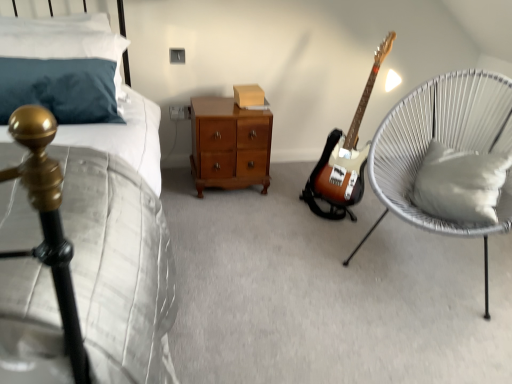
This screenshot has height=384, width=512. Describe the element at coordinates (60, 67) in the screenshot. I see `teal fabric pillow at upper left, placed as the first pillow when sorted from left to right` at that location.

Locate an element on the screen. This screenshot has width=512, height=384. teal fabric pillow at upper left, which is the 1th pillow in top-to-bottom order is located at coordinates (60, 67).

This screenshot has width=512, height=384. Describe the element at coordinates (229, 145) in the screenshot. I see `wooden nightstand at center` at that location.

Identify the location of matte gold headboard at left. tap(103, 220).

Describe the element at coordinates (460, 184) in the screenshot. The width and height of the screenshot is (512, 384). I see `white soft cushion at right, which is the 2th pillow in left-to-right order` at that location.

Locate an element on the screen. teal fabric pillow at upper left, which appears as the second pillow when ordered from the bottom is located at coordinates point(60,67).

Looking at their sizes, would you say white woven chair at right is wider or thinner than matte gold headboard at left?

Clearly, white woven chair at right has less width compared to matte gold headboard at left.

From the image's perspective, which is below, white woven chair at right or matte gold headboard at left?

matte gold headboard at left, from the image's perspective.

In the image, is white woven chair at right positioned in front of or behind matte gold headboard at left?

Clearly, white woven chair at right is behind matte gold headboard at left.

Between white soft cushion at right, which is the 2th pillow in left-to-right order, and matte cardboard box at center, which one has larger width?

white soft cushion at right, which is the 2th pillow in left-to-right order.

Who is more distant, white soft cushion at right, which is the 1th pillow from bottom to top, or matte cardboard box at center?

matte cardboard box at center is further away from the camera.

Which of these two, white soft cushion at right, which is the 1th pillow from bottom to top, or matte cardboard box at center, is smaller?

matte cardboard box at center is smaller.

Is white soft cushion at right, placed as the 2th pillow when sorted from top to bottom, at the right side of matte cardboard box at center?

Yes.

Is matte cardboard box at center situated inside matte gold headboard at left or outside?

matte cardboard box at center is outside matte gold headboard at left.

Which of these two, matte cardboard box at center or matte gold headboard at left, is smaller?

matte cardboard box at center is smaller.

From a real-world perspective, does matte cardboard box at center sit lower than matte gold headboard at left?

Incorrect, from a real-world perspective, matte cardboard box at center is higher than matte gold headboard at left.

Can you confirm if wooden nightstand at center is shorter than matte gold headboard at left?

Yes, wooden nightstand at center is shorter than matte gold headboard at left.

From the image's perspective, between wooden nightstand at center and matte gold headboard at left, which one is located above?

From the image's view, wooden nightstand at center is above.

Based on the photo, considering the relative sizes of wooden nightstand at center and matte gold headboard at left in the image provided, is wooden nightstand at center wider than matte gold headboard at left?

In fact, wooden nightstand at center might be narrower than matte gold headboard at left.

Based on the photo, from a real-world perspective, is wooden nightstand at center beneath matte gold headboard at left?

Yes, from a real-world perspective, wooden nightstand at center is beneath matte gold headboard at left.

Considering the relative positions of teal fabric pillow at upper left, which is the 1th pillow in top-to-bottom order, and wooden nightstand at center in the image provided, is teal fabric pillow at upper left, which is the 1th pillow in top-to-bottom order, in front of wooden nightstand at center?

That is True.

Consider the image. Is teal fabric pillow at upper left, which appears as the second pillow when ordered from the bottom, inside the boundaries of wooden nightstand at center, or outside?

teal fabric pillow at upper left, which appears as the second pillow when ordered from the bottom, exists outside the volume of wooden nightstand at center.

Considering the sizes of teal fabric pillow at upper left, which is the 1th pillow in top-to-bottom order, and wooden nightstand at center in the image, is teal fabric pillow at upper left, which is the 1th pillow in top-to-bottom order, wider or thinner than wooden nightstand at center?

Considering their sizes, teal fabric pillow at upper left, which is the 1th pillow in top-to-bottom order, looks slimmer than wooden nightstand at center.

Is teal fabric pillow at upper left, which is the 1th pillow in top-to-bottom order, turned away from wooden nightstand at center?

No, teal fabric pillow at upper left, which is the 1th pillow in top-to-bottom order, is not facing away from wooden nightstand at center.

Considering the sizes of objects white soft cushion at right, which is the 2th pillow in left-to-right order, and matte gold headboard at left in the image provided, who is wider, white soft cushion at right, which is the 2th pillow in left-to-right order, or matte gold headboard at left?

matte gold headboard at left.

From a real-world perspective, count 1st pillows upward from the matte gold headboard at left and point to it. Please provide its 2D coordinates.

[(460, 184)]

From the image's perspective, is white soft cushion at right, which is the 1th pillow from bottom to top, located beneath matte gold headboard at left?

No, from the image's perspective, white soft cushion at right, which is the 1th pillow from bottom to top, is not below matte gold headboard at left.

Starting from the white woven chair at right, which pillow is the 2nd one behind? Please provide its 2D coordinates.

[(60, 67)]

Is white woven chair at right spatially inside teal fabric pillow at upper left, which is the 1th pillow in top-to-bottom order, or outside of it?

white woven chair at right lies outside teal fabric pillow at upper left, which is the 1th pillow in top-to-bottom order.

Is white woven chair at right positioned before teal fabric pillow at upper left, placed as the first pillow when sorted from left to right?

Yes, white woven chair at right is closer to the viewer.

Between point (429, 81) and point (80, 99), which one is positioned behind?

Positioned behind is point (429, 81).

Where is `bed that appears below the white woven chair at right (from a real-world perspective)`? The height and width of the screenshot is (384, 512). bed that appears below the white woven chair at right (from a real-world perspective) is located at coordinates coord(103,220).

Identify the location of box that appears above the white soft cushion at right, the first pillow viewed from the right (from a real-world perspective). This screenshot has height=384, width=512. (248, 95).

When comparing their distances from white soft cushion at right, placed as the 2th pillow when sorted from top to bottom, does matte gold headboard at left or white woven chair at right seem closer?

Among the two, white woven chair at right is located nearer to white soft cushion at right, placed as the 2th pillow when sorted from top to bottom.

Looking at the image, which one is located further to matte cardboard box at center, wooden nightstand at center or matte gold headboard at left?

matte gold headboard at left lies further to matte cardboard box at center than the other object.

Estimate the real-world distances between objects in this image. Which object is closer to white soft cushion at right, which is the 1th pillow from bottom to top, teal fabric pillow at upper left, which is the 1th pillow in top-to-bottom order, or matte gold headboard at left?

matte gold headboard at left is positioned closer to the anchor white soft cushion at right, which is the 1th pillow from bottom to top.

Based on their spatial positions, is matte cardboard box at center or wooden nightstand at center closer to sunburst wood electric guitar at center?

wooden nightstand at center.

Looking at the image, which one is located further to white soft cushion at right, which is the 2th pillow in left-to-right order, sunburst wood electric guitar at center or teal fabric pillow at upper left, which appears as the second pillow when ordered from the bottom?

teal fabric pillow at upper left, which appears as the second pillow when ordered from the bottom, is positioned further to the anchor white soft cushion at right, which is the 2th pillow in left-to-right order.

Considering their positions, is wooden nightstand at center positioned closer to white soft cushion at right, the first pillow viewed from the right, than white woven chair at right?

white woven chair at right is positioned closer to the anchor white soft cushion at right, the first pillow viewed from the right.

From the image, which object appears to be farther from matte cardboard box at center, teal fabric pillow at upper left, placed as the first pillow when sorted from left to right, or white soft cushion at right, which is the 2th pillow in left-to-right order?

white soft cushion at right, which is the 2th pillow in left-to-right order.

Which object lies nearer to the anchor point matte cardboard box at center, wooden nightstand at center or sunburst wood electric guitar at center?

Among the two, wooden nightstand at center is located nearer to matte cardboard box at center.

Identify the location of chair situated between matte gold headboard at left and white soft cushion at right, which is the 1th pillow from bottom to top, from left to right. This screenshot has width=512, height=384. tap(443, 143).

This screenshot has width=512, height=384. In order to click on bed between teal fabric pillow at upper left, placed as the first pillow when sorted from left to right, and white woven chair at right, in the horizontal direction in this screenshot , I will do `click(103, 220)`.

The width and height of the screenshot is (512, 384). Find the location of `guitar between teal fabric pillow at upper left, which appears as the second pillow when ordered from the bottom, and white woven chair at right`. guitar between teal fabric pillow at upper left, which appears as the second pillow when ordered from the bottom, and white woven chair at right is located at coordinates 347,150.

This screenshot has height=384, width=512. I want to click on nightstand between matte gold headboard at left and matte cardboard box at center along the z-axis, so click(x=229, y=145).